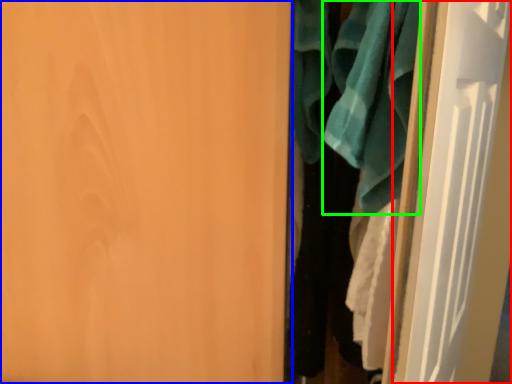
Question: Considering the real-world distances, which object is closest to door (highlighted by a red box)? door (highlighted by a blue box) or bath towel (highlighted by a green box).

Choices:
 (A) door
 (B) bath towel

Answer: (B)